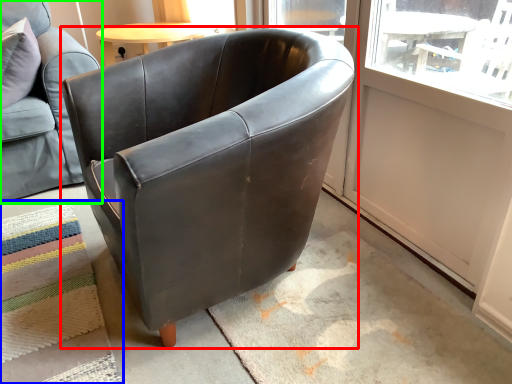
Question: Based on their relative distances, which object is nearer to chair (highlighted by a red box)? Choose from mat (highlighted by a blue box) and chair (highlighted by a green box).

Choices:
 (A) mat
 (B) chair

Answer: (A)